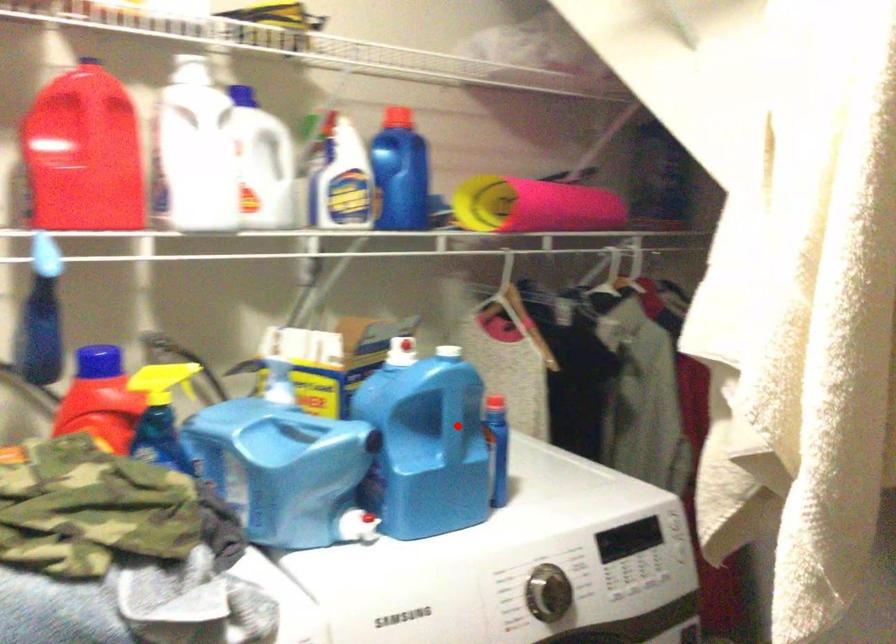
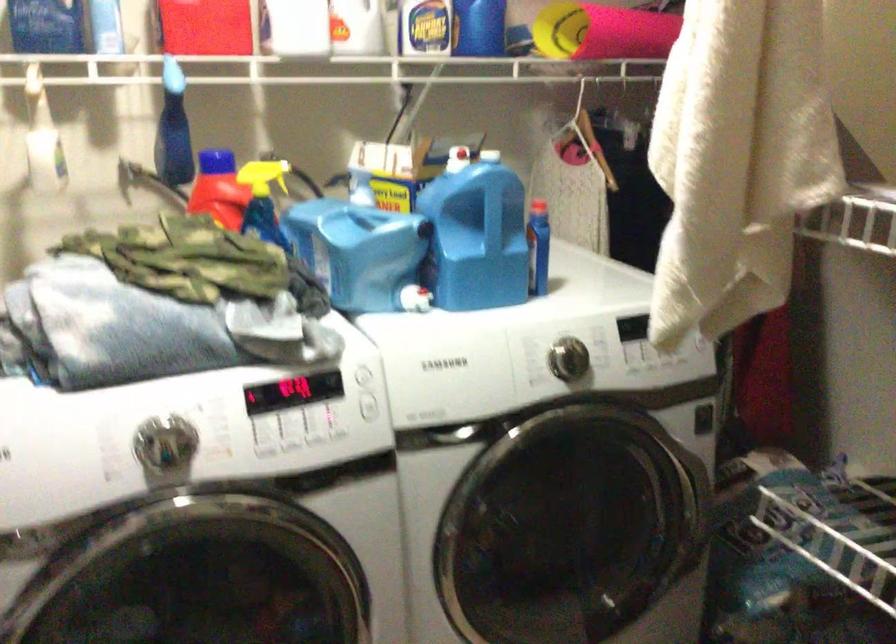
Question: I am providing you with two images of the same scene from different viewpoints. A red point is marked on the first image. Can you still see the location of the red point in image 2?

Choices:
 (A) Yes
 (B) No

Answer: (A)